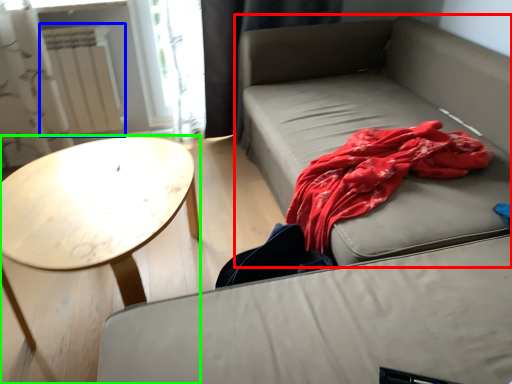
Question: Estimate the real-world distances between objects in this image. Which object is farther from studio couch (highlighted by a red box), radiator (highlighted by a blue box) or coffee table (highlighted by a green box)?

Choices:
 (A) radiator
 (B) coffee table

Answer: (A)